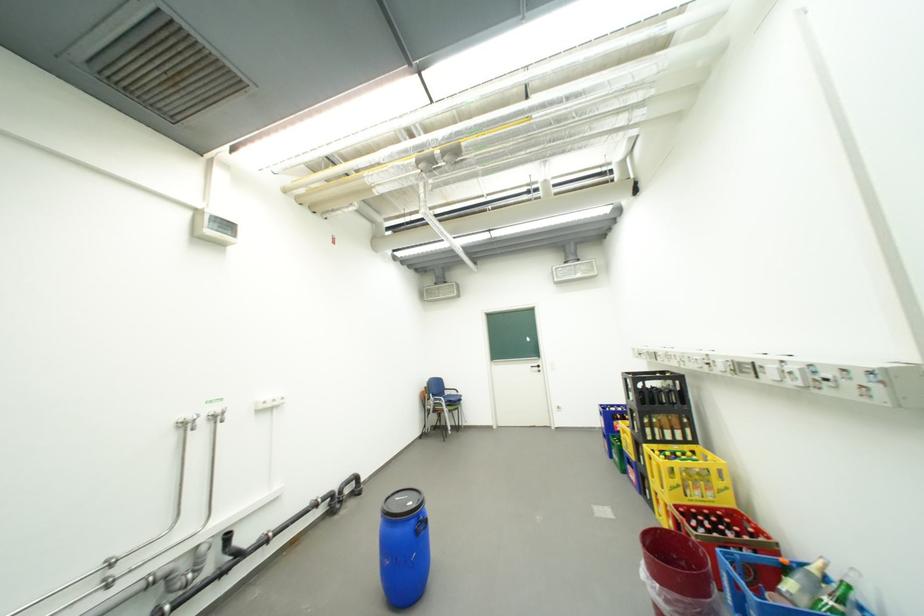
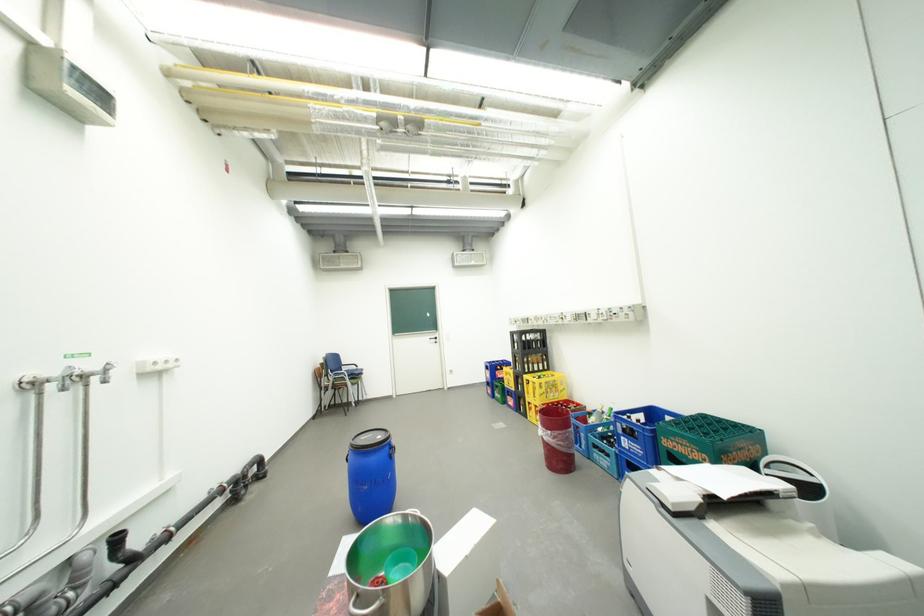
Question: The camera is either moving clockwise (left) or counter-clockwise (right) around the object. The first image is from the beginning of the video and the second image is from the end. Is the camera moving left or right when shooting the video?

Choices:
 (A) Left
 (B) Right

Answer: (A)